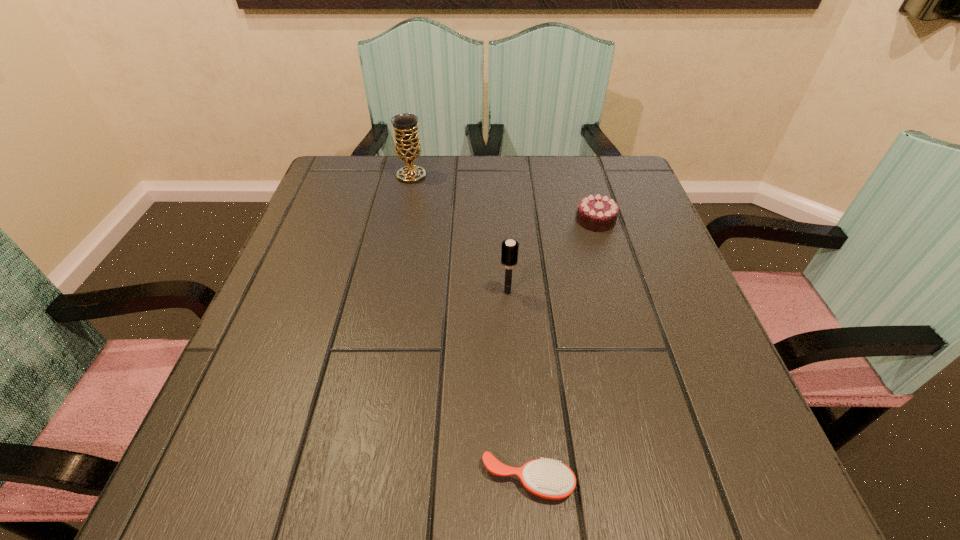
The width and height of the screenshot is (960, 540). Identify the location of vacant region located on the left of the chocolate cake. (514, 220).

Where is `vacant space situated 0.190m on the left of the shortest object`? The height and width of the screenshot is (540, 960). vacant space situated 0.190m on the left of the shortest object is located at coordinates (342, 480).

Locate an element on the screen. This screenshot has width=960, height=540. chalice located in the far edge section of the desktop is located at coordinates (407, 145).

Locate an element on the screen. Image resolution: width=960 pixels, height=540 pixels. chocolate cake located in the far edge section of the desktop is located at coordinates (598, 213).

Where is `object located at the near edge`? The width and height of the screenshot is (960, 540). object located at the near edge is located at coordinates (547, 478).

Locate an element on the screen. This screenshot has height=540, width=960. object that is at the right edge is located at coordinates (598, 213).

At what (x,y) coordinates should I click in order to perform the action: click on object positioned at the far right corner. Please return your answer as a coordinate pair (x, y). Image resolution: width=960 pixels, height=540 pixels. Looking at the image, I should click on (598, 213).

The width and height of the screenshot is (960, 540). What are the coordinates of `vacant space at the far edge of the desktop` in the screenshot? It's located at (477, 161).

The image size is (960, 540). In the image, there is a desktop. Identify the location of free space at the left edge. (357, 235).

The image size is (960, 540). Identify the location of vacant space at the right edge of the desktop. (612, 268).